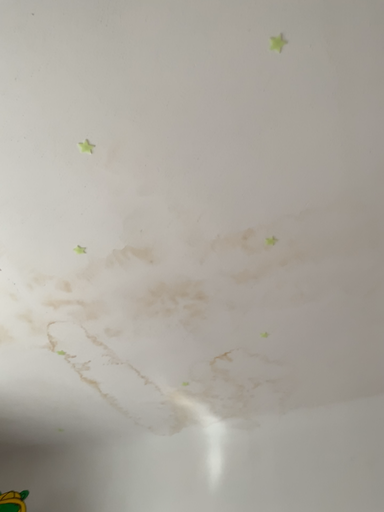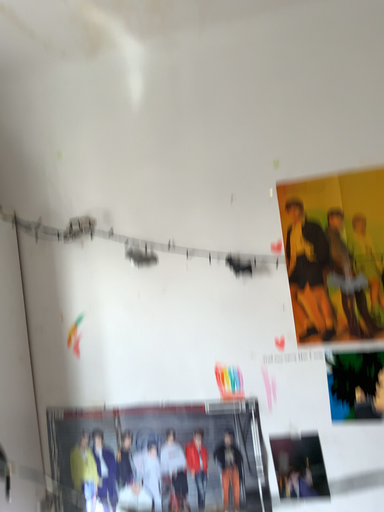
Question: How did the camera likely rotate when shooting the video?

Choices:
 (A) rotated upward
 (B) rotated downward

Answer: (B)